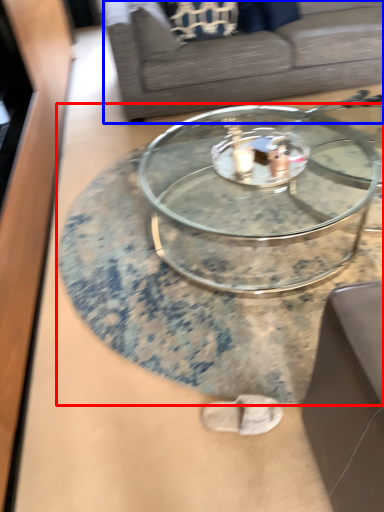
Question: Which point is closer to the camera, coffee table (highlighted by a red box) or studio couch (highlighted by a blue box)?

Choices:
 (A) coffee table
 (B) studio couch

Answer: (A)